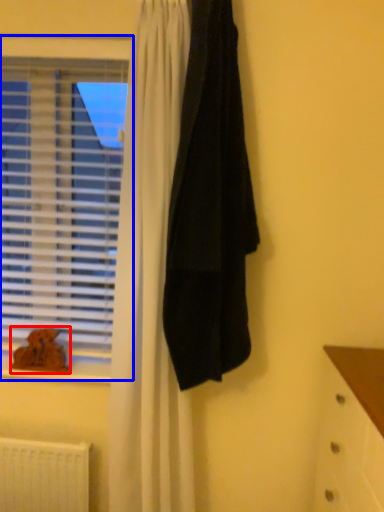
Question: Which object appears closest to the camera in this image, animal (highlighted by a red box) or window (highlighted by a blue box)?

Choices:
 (A) animal
 (B) window

Answer: (B)